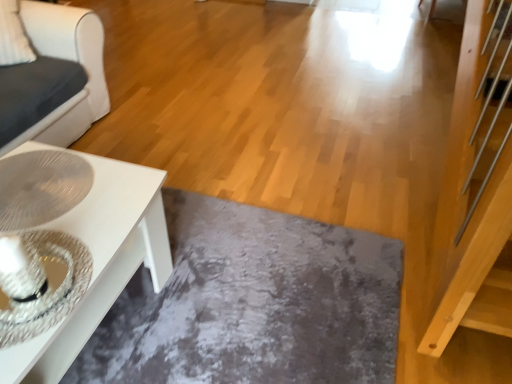
Locate an element on the screen. This screenshot has width=512, height=384. vacant space behind slate at lower center is located at coordinates (265, 152).